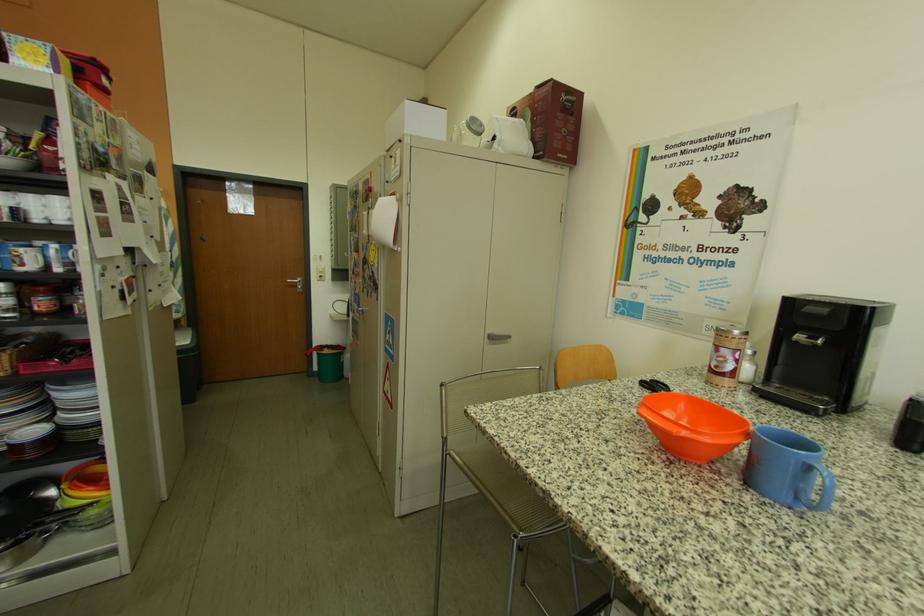
Find where to lift the green bucket. Please return your answer as a coordinate pair (x, y).

(329, 362)